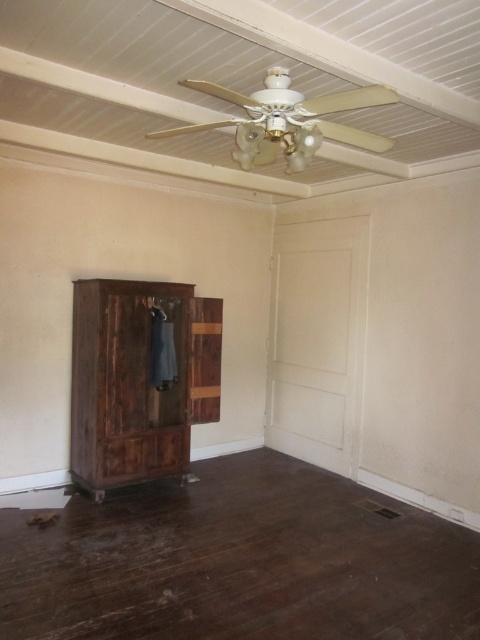
You are organizing a closet and need to place both the dark brown wood armoire at left and the denim hanger at left. Given their widths, which one requires more horizontal space to accommodate?

The dark brown wood armoire at left requires more horizontal space because its width surpasses that of the denim hanger at left.

You are organizing your closet and need to place both the dark brown wood armoire at left and the denim hanger at left. Since you have limited space, which object should you consider moving first to free up more room?

The dark brown wood armoire at left is bigger than the denim hanger at left, so you should consider moving the dark brown wood armoire at left first to free up more space.

You are standing in the room and want to place a 12 feet long sofa in front of the dark brown wood armoire at left. Is there enough space between you and the armoire to fit the sofa?

The dark brown wood armoire at left is 13.35 feet from the camera. Since the sofa is 12 feet long, there is enough space to place it in front of the armoire as the distance is greater than the sofa length.